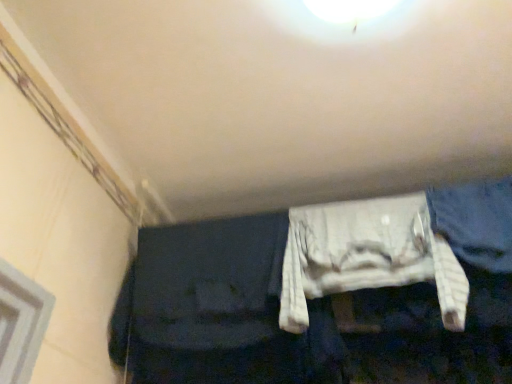
I want to click on free spot above white fabric cushion at center (from a real-world perspective), so click(364, 203).